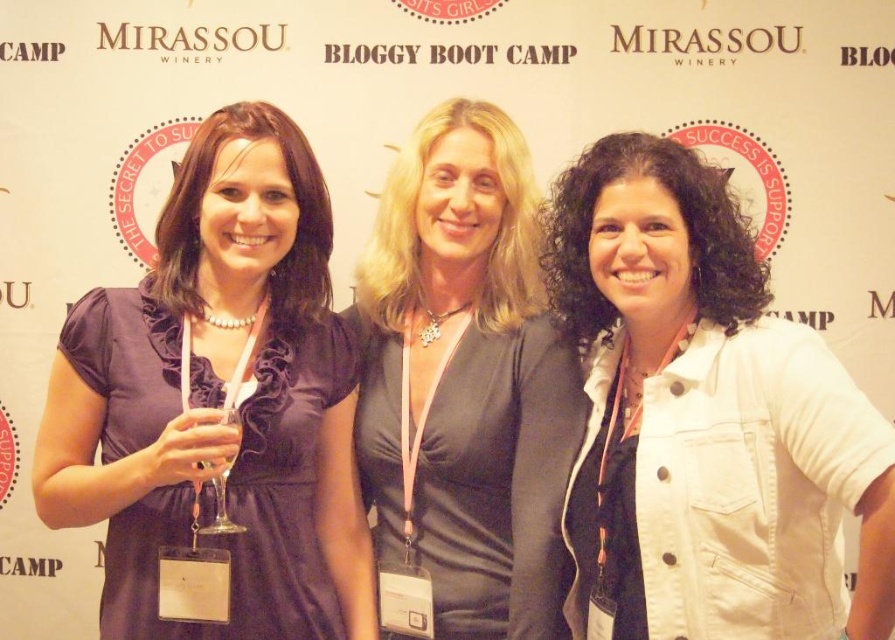
You are a photographer setting up for a group photo. You need to position a light source 1.2 meters away from the white denim jacket at right. Will the light source interfere with the clear glass wine at center?

The distance between the white denim jacket at right and the clear glass wine at center is 1.50 meters. Since the light source is placed 1.2 meters from the jacket, it will be 0.3 meters away from the wine glass, which may cause interference.

You are at a wine tasting event and see the clear glass wine at center and the clear glass wine glass at center. Which object is placed on top of the other?

The clear glass wine at center is positioned over the clear glass wine glass at center, so the wine is on top of the wine glass.

Based on the scene description, where exactly is the clear glass wine at center located in terms of coordinates?

The clear glass wine at center is located at coordinates point (218, 445).